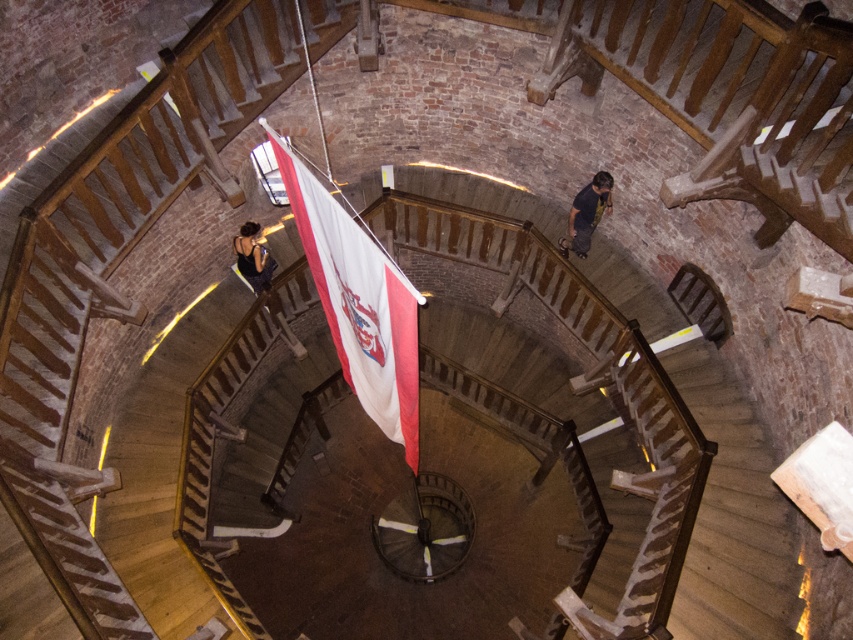
Question: Which point is farther to the camera?

Choices:
 (A) white fabric flag at center
 (B) black fabric at lower left
 (C) dark blue shirt at center

Answer: (B)

Question: Which point is closer to the camera taking this photo?

Choices:
 (A) (605, 196)
 (B) (392, 346)

Answer: (B)

Question: Is white fabric flag at center above dark blue shirt at center?

Choices:
 (A) yes
 (B) no

Answer: (B)

Question: Which point is closer to the camera?

Choices:
 (A) white fabric flag at center
 (B) dark blue shirt at center

Answer: (A)

Question: Does white fabric flag at center appear on the left side of dark blue shirt at center?

Choices:
 (A) yes
 (B) no

Answer: (A)

Question: Does dark blue shirt at center lie behind black fabric at lower left?

Choices:
 (A) yes
 (B) no

Answer: (B)